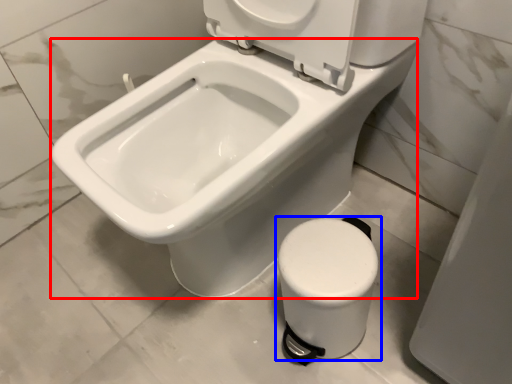
Question: Which of the following is the closest to the observer, bidet (highlighted by a red box) or toilet (highlighted by a blue box)?

Choices:
 (A) bidet
 (B) toilet

Answer: (A)